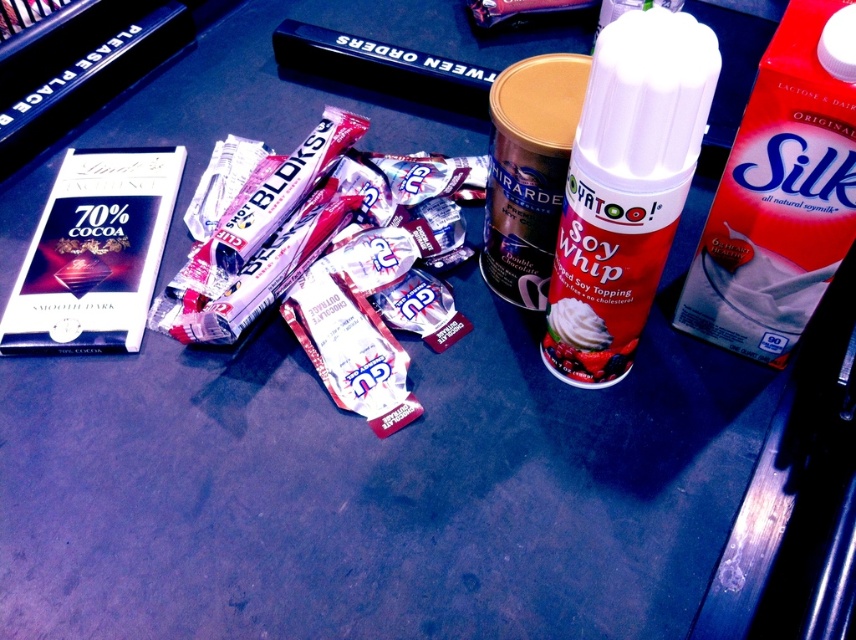
Measure the distance between red cardboard carton at right and red matte soy whip can at center.

They are 4.36 inches apart.

Is point (722, 340) positioned behind point (639, 28)?

Yes, it is behind point (639, 28).

Image resolution: width=856 pixels, height=640 pixels. I want to click on red cardboard carton at right, so click(782, 193).

Which of these two, red matte soy whip can at center or metallic gold canister at center, stands shorter?

With less height is metallic gold canister at center.

Can you confirm if red matte soy whip can at center is positioned below metallic gold canister at center?

Indeed, red matte soy whip can at center is positioned under metallic gold canister at center.

Which is in front, point (623, 160) or point (565, 136)?

Positioned in front is point (623, 160).

Find the location of a particular element. Image resolution: width=856 pixels, height=640 pixels. red matte soy whip can at center is located at coordinates (625, 188).

Is point (727, 304) farther from viewer compared to point (536, 108)?

Yes, it is behind point (536, 108).

In the scene shown: Can you confirm if red cardboard carton at right is wider than metallic gold canister at center?

Yes.

The width and height of the screenshot is (856, 640). What do you see at coordinates (782, 193) in the screenshot?
I see `red cardboard carton at right` at bounding box center [782, 193].

The image size is (856, 640). In order to click on red cardboard carton at right in this screenshot , I will do `click(782, 193)`.